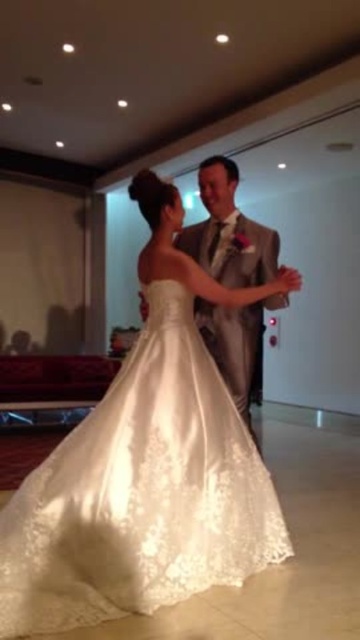
Can you confirm if ivory satin dress at center is positioned to the left of satin/velvet suit at center?

Indeed, ivory satin dress at center is positioned on the left side of satin/velvet suit at center.

Does ivory satin dress at center have a lesser width compared to satin/velvet suit at center?

No, ivory satin dress at center is not thinner than satin/velvet suit at center.

Image resolution: width=360 pixels, height=640 pixels. I want to click on ivory satin dress at center, so click(x=141, y=492).

This screenshot has width=360, height=640. I want to click on ivory satin dress at center, so click(141, 492).